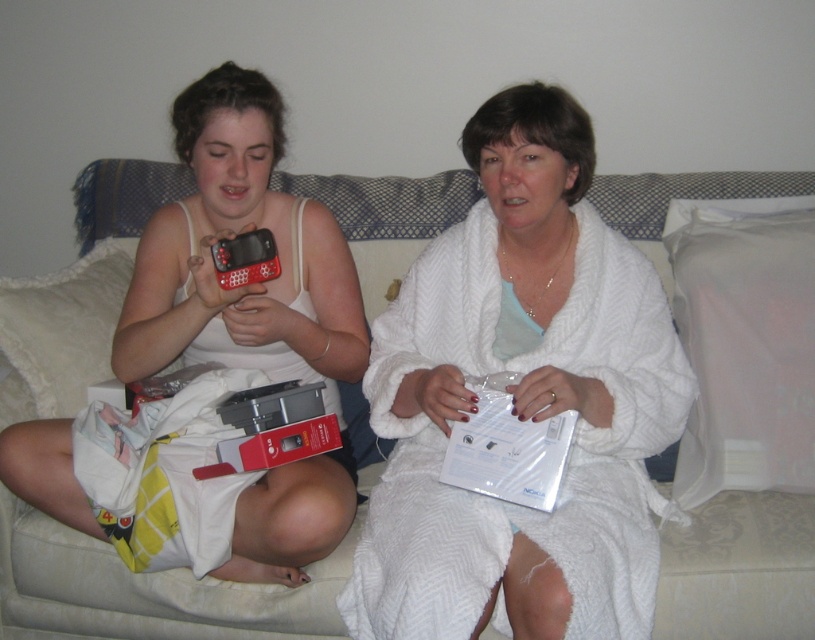
Question: Can you confirm if white fluffy robe at center is bigger than matte black phone at center?

Choices:
 (A) yes
 (B) no

Answer: (A)

Question: Which of the following is the farthest from the observer?

Choices:
 (A) (x=492, y=198)
 (B) (x=199, y=205)
 (C) (x=153, y=576)

Answer: (B)

Question: Is white fluffy robe at center positioned in front of beige fabric couch at center?

Choices:
 (A) yes
 (B) no

Answer: (A)

Question: Which point is closer to the camera?

Choices:
 (A) (148, 278)
 (B) (540, 580)
 (C) (357, 413)

Answer: (B)

Question: Which point is farther from the camera taking this photo?

Choices:
 (A) (306, 284)
 (B) (499, 250)

Answer: (A)

Question: Can you confirm if beige fabric couch at center is smaller than matte black phone at center?

Choices:
 (A) no
 (B) yes

Answer: (A)